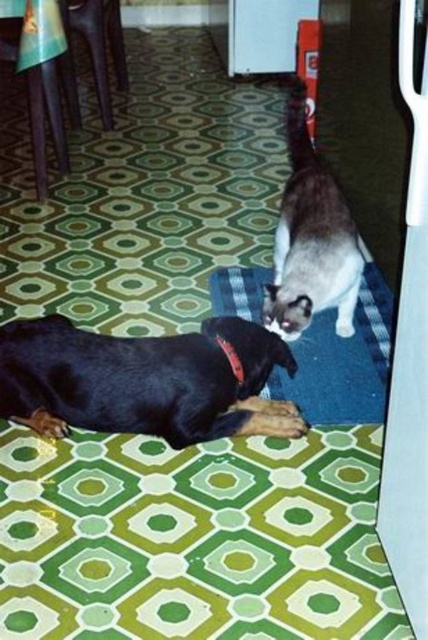
Between point (321, 173) and point (220, 339), which one is positioned behind?

The point (321, 173) is more distant.

Can you confirm if white fur cat at upper center is positioned to the right of black fabric neckband at lower center?

Correct, you'll find white fur cat at upper center to the right of black fabric neckband at lower center.

At what (x,y) coordinates should I click in order to perform the action: click on white fur cat at upper center. Please return your answer as a coordinate pair (x, y). This screenshot has width=428, height=640. Looking at the image, I should click on (311, 237).

Find the location of a particular element. The height and width of the screenshot is (640, 428). white fur cat at upper center is located at coordinates (311, 237).

From the picture: Is black glossy dog at lower left bigger than black fabric neckband at lower center?

Correct, black glossy dog at lower left is larger in size than black fabric neckband at lower center.

Locate an element on the screen. black glossy dog at lower left is located at coordinates (142, 381).

Locate an element on the screen. The height and width of the screenshot is (640, 428). black glossy dog at lower left is located at coordinates (142, 381).

Is black glossy dog at lower left above blue carpet at center?

No, black glossy dog at lower left is not above blue carpet at center.

Can you confirm if black glossy dog at lower left is smaller than blue carpet at center?

Indeed, black glossy dog at lower left has a smaller size compared to blue carpet at center.

Which is behind, point (234, 404) or point (330, 408)?

The point (330, 408) is behind.

Identify the location of black glossy dog at lower left. This screenshot has height=640, width=428. (142, 381).